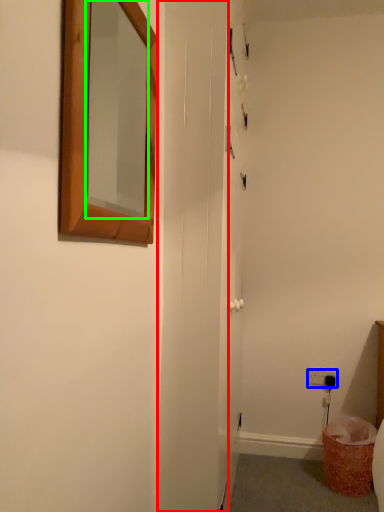
Question: Estimate the real-world distances between objects in this image. Which object is farther from screen door (highlighted by a red box), electric outlet (highlighted by a blue box) or mirror (highlighted by a green box)?

Choices:
 (A) electric outlet
 (B) mirror

Answer: (A)